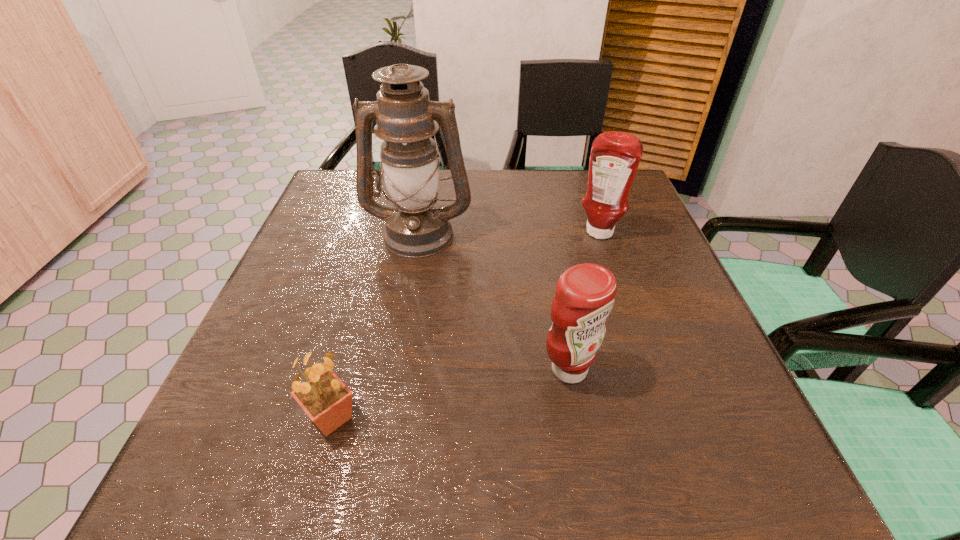
This screenshot has height=540, width=960. In the image, there is a desktop. Identify the location of vacant space at the left edge. (285, 431).

Where is `free space at the right edge of the desktop`? This screenshot has width=960, height=540. free space at the right edge of the desktop is located at coordinates (654, 383).

Locate an element on the screen. Image resolution: width=960 pixels, height=540 pixels. free space at the far left corner of the desktop is located at coordinates (327, 181).

Identify the location of vacant area at the near left corner. Image resolution: width=960 pixels, height=540 pixels. (255, 481).

In the image, there is a desktop. Identify the location of free region at the near right corner. This screenshot has height=540, width=960. (734, 478).

Where is `free space that is in between the sunflower and the farther condiment`? The height and width of the screenshot is (540, 960). free space that is in between the sunflower and the farther condiment is located at coordinates coord(466,326).

The height and width of the screenshot is (540, 960). I want to click on vacant space that's between the tallest object and the nearer condiment, so click(494, 301).

Where is `vacant point located between the third object from left to right and the oil lamp`? The height and width of the screenshot is (540, 960). vacant point located between the third object from left to right and the oil lamp is located at coordinates (494, 301).

The image size is (960, 540). I want to click on blank region between the left condiment and the tallest object, so [494, 301].

At what (x,y) coordinates should I click in order to perform the action: click on empty location between the oil lamp and the third object from left to right. Please return your answer as a coordinate pair (x, y). The height and width of the screenshot is (540, 960). Looking at the image, I should click on (494, 301).